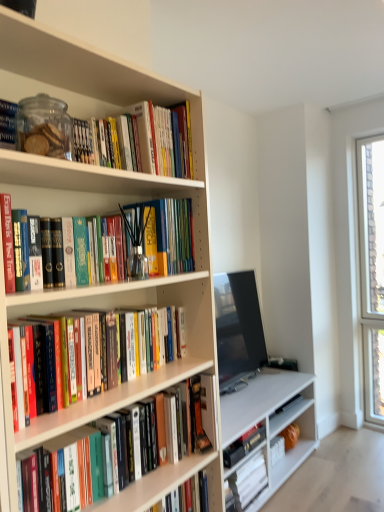
Question: Is hardcover book at lower center, the 3th book positioned from the bottom, taller or shorter than hardcover books at center, placed as the 3th book when sorted from top to bottom?

Choices:
 (A) tall
 (B) short

Answer: (B)

Question: Based on their sizes in the image, would you say hardcover book at lower center, the 3th book positioned from the bottom, is bigger or smaller than hardcover books at center, positioned as the fifth book in bottom-to-top order?

Choices:
 (A) big
 (B) small

Answer: (B)

Question: Based on their relative distances, which object is nearer to the white matte bookcase at left?

Choices:
 (A) hardcover book at lower center, the first book from the bottom
 (B) matte glass jar at upper left, positioned as the 1th book in top-to-bottom order
 (C) hardcover book at center, the fourth book in the bottom-to-top sequence
 (D) matte black tv at center
 (E) hardcover book at lower center, the 3th book positioned from the bottom

Answer: (B)

Question: Which of these objects is positioned closest to the hardcover books at upper left, which is counted as the 2th book, starting from the top?

Choices:
 (A) hardcover books at center, positioned as the fifth book in bottom-to-top order
 (B) matte black tv at center
 (C) hardcover book at center, the fourth book when ordered from top to bottom
 (D) white matte bookcase at left
 (E) hardcover book at lower center, placed as the 2th book when sorted from bottom to top

Answer: (D)